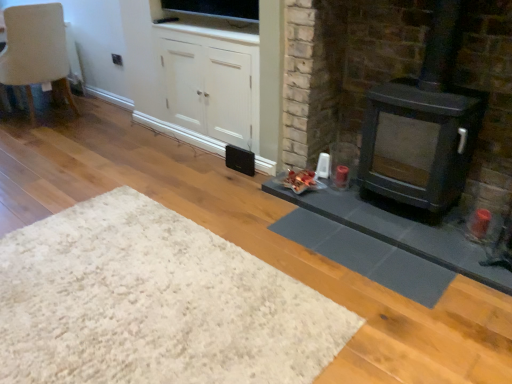
Question: Is white matte cabinet at center inside or outside of white shaggy rug at lower left?

Choices:
 (A) inside
 (B) outside

Answer: (B)

Question: From a real-world perspective, relative to white shaggy rug at lower left, is white matte cabinet at center vertically above or below?

Choices:
 (A) above
 (B) below

Answer: (A)

Question: Which object is the farthest from the white shaggy rug at lower left?

Choices:
 (A) beige fabric chair at upper left
 (B) gray rubber mat at lower right
 (C) white matte cabinet at center
 (D) black matte speaker at center
 (E) matte black wood burning stove at right

Answer: (A)

Question: Based on their relative distances, which object is farther from the gray rubber mat at lower right?

Choices:
 (A) matte black stove at right
 (B) beige fabric chair at upper left
 (C) black matte speaker at center
 (D) matte black wood burning stove at right
 (E) white shaggy rug at lower left

Answer: (B)